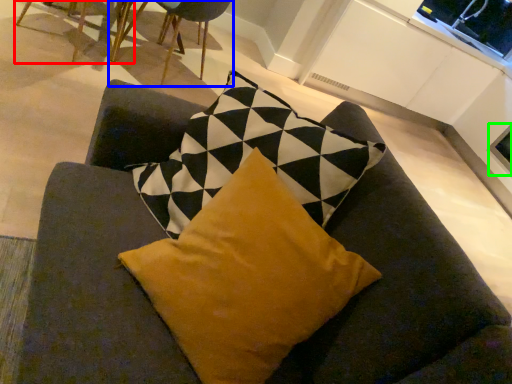
Question: Which is nearer to the chair (highlighted by a red box)? chair (highlighted by a blue box) or window screen (highlighted by a green box).

Choices:
 (A) chair
 (B) window screen

Answer: (A)